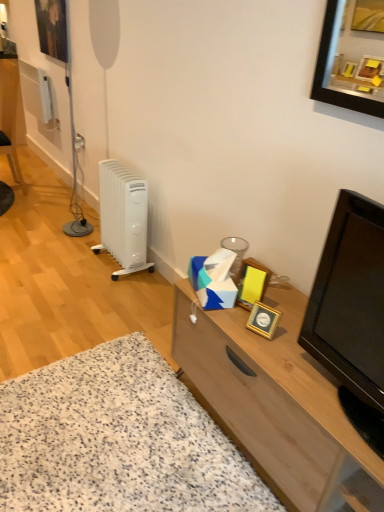
You are a GUI agent. You are given a task and a screenshot of the screen. Output one action in this format:
    pyautogui.click(x=<x>, y=<y>)
    Task: Click on the free space above wooden cabinet at center (from a real-world perspective)
    This screenshot has width=384, height=512.
    Given the screenshot: What is the action you would take?
    pyautogui.click(x=290, y=343)